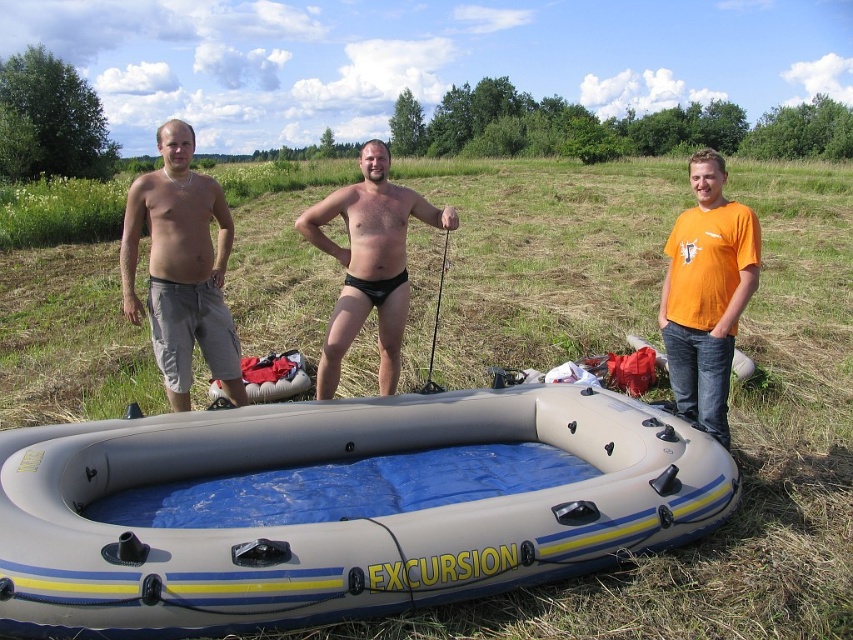
Question: From the image, what is the correct spatial relationship of orange cotton t-shirt at right in relation to black rubber fishing pole at center?

Choices:
 (A) below
 (B) above

Answer: (A)

Question: Is matte gray shorts at left further to camera compared to orange cotton t-shirt at right?

Choices:
 (A) yes
 (B) no

Answer: (A)

Question: Does gray rubber boat at center appear on the left side of matte gray shorts at left?

Choices:
 (A) no
 (B) yes

Answer: (A)

Question: Which object appears closest to the camera in this image?

Choices:
 (A) orange cotton t-shirt at right
 (B) matte gray shorts at left
 (C) gray rubber boat at center
 (D) black matte swim trunks at center

Answer: (C)

Question: Which of the following is the farthest from the observer?

Choices:
 (A) (685, 396)
 (B) (45, 502)
 (C) (436, 301)

Answer: (C)

Question: Which is nearer to the matte gray shorts at left?

Choices:
 (A) gray rubber boat at center
 (B) black matte swim trunks at center

Answer: (B)